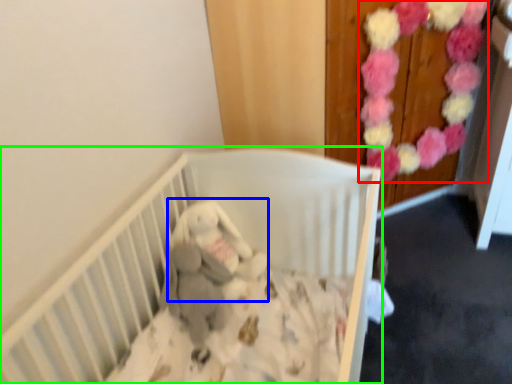
Question: Considering the real-world distances, which object is farthest from flower (highlighted by a red box)? baby elephant (highlighted by a blue box) or infant bed (highlighted by a green box)?

Choices:
 (A) baby elephant
 (B) infant bed

Answer: (A)